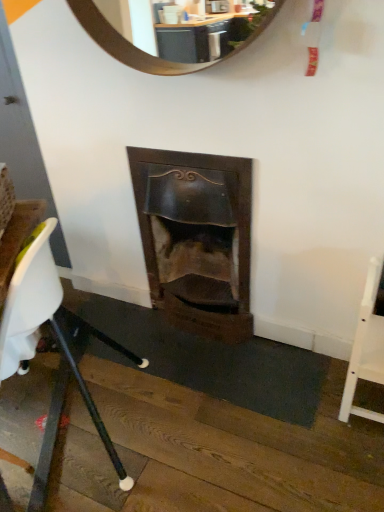
Question: Is wooden fireplace at center wider than white plastic chair at lower left, acting as the first chair starting from the left?

Choices:
 (A) no
 (B) yes

Answer: (A)

Question: Could you tell me if wooden fireplace at center is turned towards white plastic chair at lower left, acting as the first chair starting from the left?

Choices:
 (A) yes
 (B) no

Answer: (A)

Question: Is wooden fireplace at center behind white plastic chair at lower left, acting as the first chair starting from the left?

Choices:
 (A) no
 (B) yes

Answer: (B)

Question: From a real-world perspective, is wooden fireplace at center positioned over white plastic chair at lower left, which is the second chair in right-to-left order, based on gravity?

Choices:
 (A) yes
 (B) no

Answer: (B)

Question: Does wooden fireplace at center have a smaller size compared to white plastic chair at lower left, acting as the first chair starting from the left?

Choices:
 (A) no
 (B) yes

Answer: (B)

Question: From the image's perspective, is wooden fireplace at center below white plastic chair at lower left, which is the second chair in right-to-left order?

Choices:
 (A) yes
 (B) no

Answer: (B)

Question: Considering the relative sizes of wooden fireplace at center and white wood chair at right, placed as the 2th chair when sorted from left to right, in the image provided, is wooden fireplace at center smaller than white wood chair at right, placed as the 2th chair when sorted from left to right,?

Choices:
 (A) no
 (B) yes

Answer: (A)

Question: Is the depth of wooden fireplace at center greater than that of white wood chair at right, placed as the 2th chair when sorted from left to right?

Choices:
 (A) no
 (B) yes

Answer: (B)

Question: Considering the relative positions of wooden fireplace at center and white wood chair at right, the first chair viewed from the right, in the image provided, is wooden fireplace at center to the left of white wood chair at right, the first chair viewed from the right, from the viewer's perspective?

Choices:
 (A) yes
 (B) no

Answer: (A)

Question: Is wooden fireplace at center thinner than white wood chair at right, the first chair viewed from the right?

Choices:
 (A) no
 (B) yes

Answer: (A)

Question: Does wooden fireplace at center have a lesser height compared to white wood chair at right, the first chair viewed from the right?

Choices:
 (A) no
 (B) yes

Answer: (A)

Question: Is wooden fireplace at center not within white wood chair at right, placed as the 2th chair when sorted from left to right?

Choices:
 (A) no
 (B) yes

Answer: (B)

Question: Considering the relative sizes of white plastic chair at lower left, which is the second chair in right-to-left order, and wooden fireplace at center in the image provided, is white plastic chair at lower left, which is the second chair in right-to-left order, bigger than wooden fireplace at center?

Choices:
 (A) no
 (B) yes

Answer: (B)